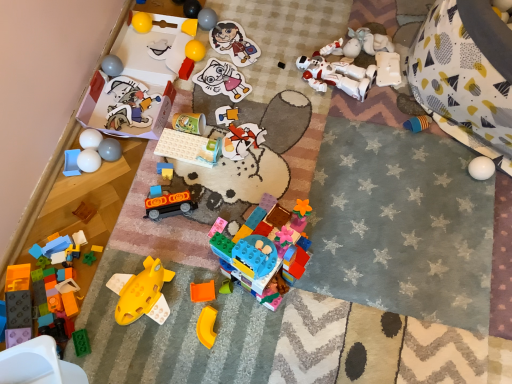
The width and height of the screenshot is (512, 384). I want to click on vacant point to the right of white matte robot at center, marked as the third toy in a right-to-left arrangement, so click(x=395, y=86).